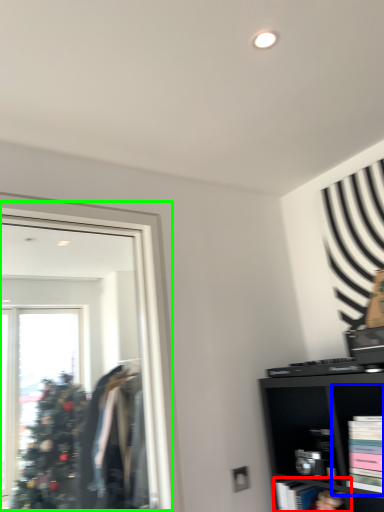
Question: Which is farther away from cabinet (highlighted by a red box)? cabinet (highlighted by a blue box) or mirror (highlighted by a green box)?

Choices:
 (A) cabinet
 (B) mirror

Answer: (B)